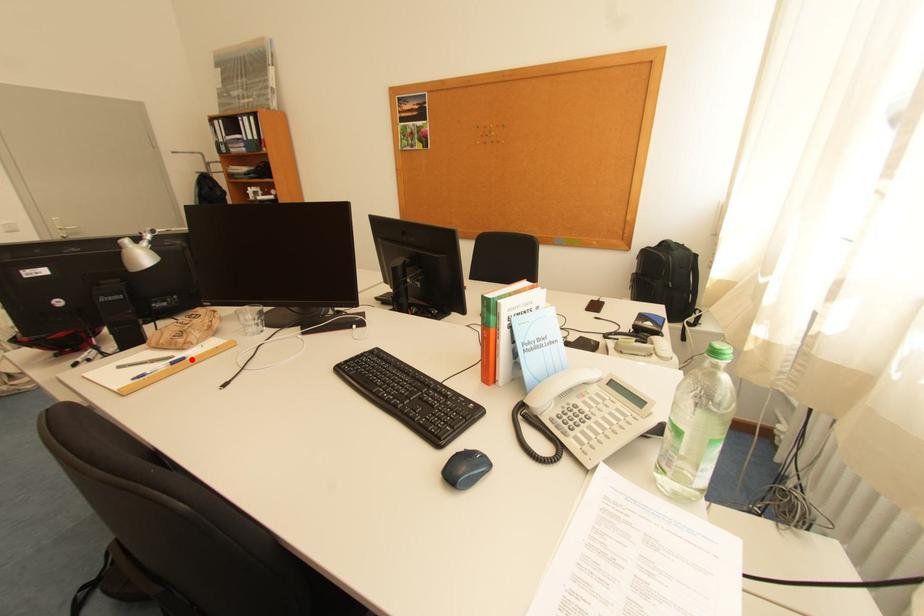
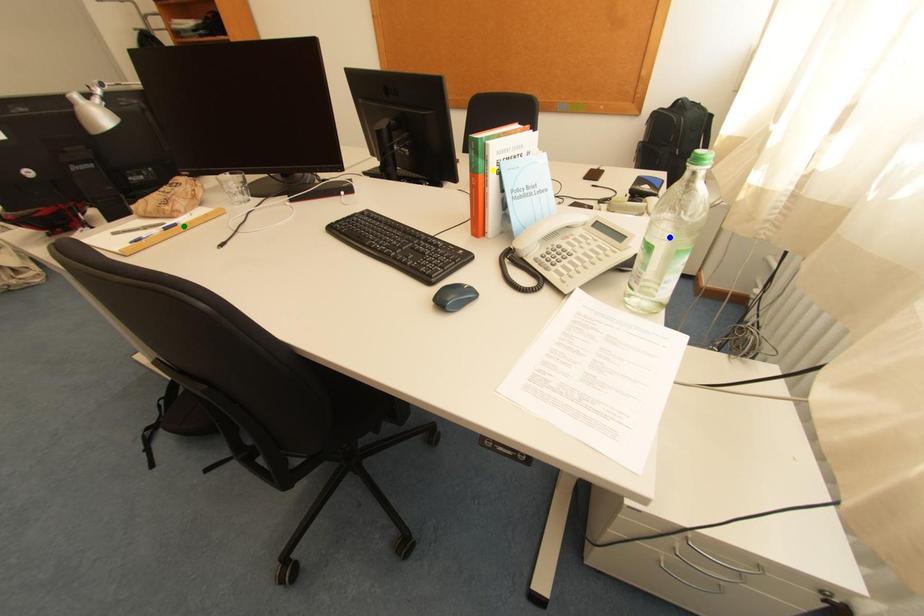
Question: I am providing you with two images of the same scene from different viewpoints. A red point is marked on the first image. You are given multiple points on the second image. Can you choose the point in image 2 that corresponds to the point in image 1?

Choices:
 (A) blue point
 (B) green point
 (C) yellow point

Answer: (B)